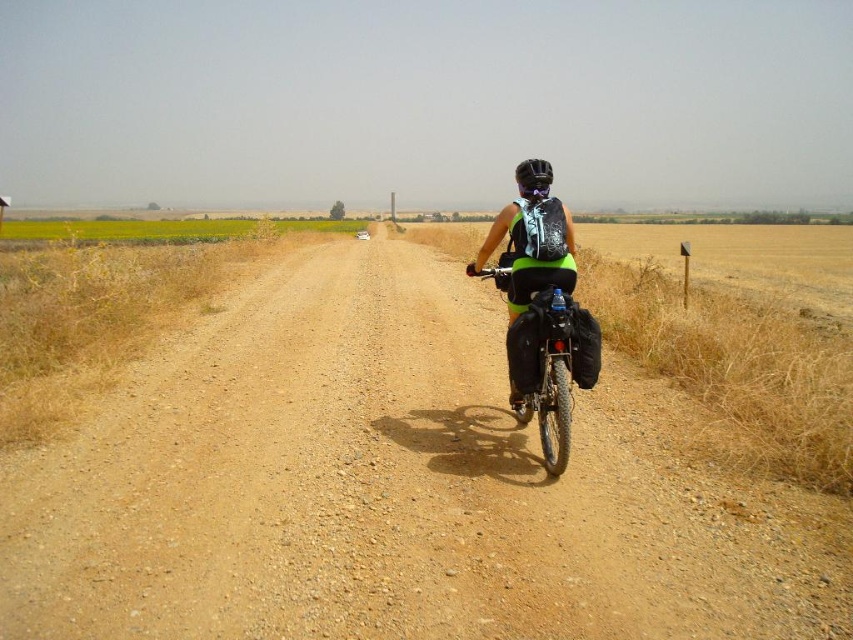
Question: Which point is farther to the camera?

Choices:
 (A) (564, 348)
 (B) (532, 250)

Answer: (B)

Question: Does matte black backpack at center appear under green fabric bicycle at center?

Choices:
 (A) yes
 (B) no

Answer: (B)

Question: In this image, where is brown gravel dirt track at center located relative to matte black backpack at center?

Choices:
 (A) below
 (B) above

Answer: (A)

Question: Which point is farther to the camera?

Choices:
 (A) green fabric bicycle at center
 (B) brown gravel dirt track at center
 (C) matte black backpack at center

Answer: (C)

Question: Considering the real-world distances, which object is closest to the brown gravel dirt track at center?

Choices:
 (A) green fabric bicycle at center
 (B) matte black backpack at center

Answer: (A)

Question: Is matte black backpack at center above green fabric bicycle at center?

Choices:
 (A) yes
 (B) no

Answer: (A)